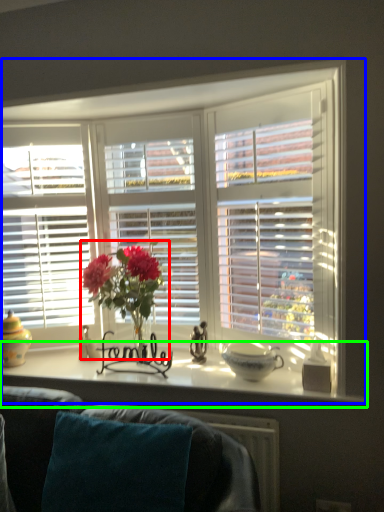
Question: Based on their relative distances, which object is farther from floral arrangement (highlighted by a red box)? Choose from window (highlighted by a blue box) and window sill (highlighted by a green box).

Choices:
 (A) window
 (B) window sill

Answer: (A)